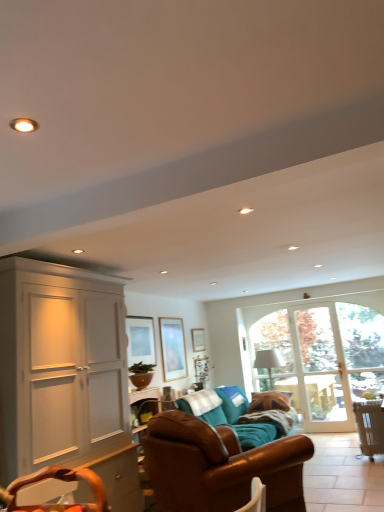
Question: Is clear glass door at right in front of matte glass picture frame at center, marked as the first picture frame in a left-to-right arrangement?

Choices:
 (A) no
 (B) yes

Answer: (A)

Question: Is clear glass door at right not within matte glass picture frame at center, the 3th picture frame positioned from the right?

Choices:
 (A) yes
 (B) no

Answer: (A)

Question: Is clear glass door at right next to matte glass picture frame at center, arranged as the third picture frame when viewed from the back, and touching it?

Choices:
 (A) yes
 (B) no

Answer: (B)

Question: Can you confirm if clear glass door at right is smaller than matte glass picture frame at center, arranged as the third picture frame when viewed from the back?

Choices:
 (A) yes
 (B) no

Answer: (B)

Question: Considering the relative positions of clear glass door at right and matte glass picture frame at center, arranged as the third picture frame when viewed from the back, in the image provided, is clear glass door at right to the right of matte glass picture frame at center, arranged as the third picture frame when viewed from the back, from the viewer's perspective?

Choices:
 (A) no
 (B) yes

Answer: (B)

Question: From the image's perspective, is clear glass door at right located beneath matte glass picture frame at center, the 3th picture frame positioned from the right?

Choices:
 (A) no
 (B) yes

Answer: (B)

Question: Is green matte plant at center taller than brown leather couch at center, the first studio couch viewed from the front?

Choices:
 (A) yes
 (B) no

Answer: (B)

Question: Is green matte plant at center shorter than brown leather couch at center, the 2th studio couch in the back-to-front sequence?

Choices:
 (A) yes
 (B) no

Answer: (A)

Question: Is green matte plant at center aimed at brown leather couch at center, the 2th studio couch in the back-to-front sequence?

Choices:
 (A) no
 (B) yes

Answer: (A)

Question: Is green matte plant at center placed right next to brown leather couch at center, the first studio couch viewed from the front?

Choices:
 (A) yes
 (B) no

Answer: (B)

Question: Is green matte plant at center far away from brown leather couch at center, the first studio couch viewed from the front?

Choices:
 (A) yes
 (B) no

Answer: (A)

Question: From a real-world perspective, is green matte plant at center physically above brown leather couch at center, the first studio couch viewed from the front?

Choices:
 (A) no
 (B) yes

Answer: (B)

Question: From a real-world perspective, does white matte cabinet at left stand above brown leather couch at center, the 2th studio couch in the back-to-front sequence?

Choices:
 (A) yes
 (B) no

Answer: (A)